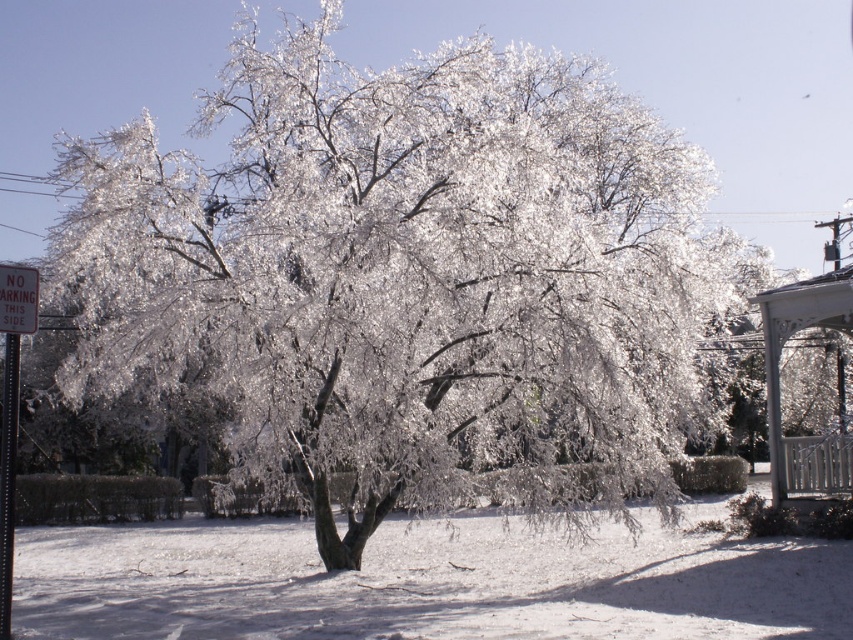
What is the position of the white painted wood gazebo at right relative to the red metal sign at upper left?

The white painted wood gazebo at right is located to the right of the red metal sign at upper left.

You are standing in the winter scene and want to take a photo of both the white painted wood gazebo at right and the red metal sign at upper left. Which object should you focus on first if you want to capture both in one frame without moving the camera?

You should focus on the white painted wood gazebo at right first because it is taller than the red metal sign at upper left, so adjusting the camera angle to include its height will naturally include the shorter sign in the frame.